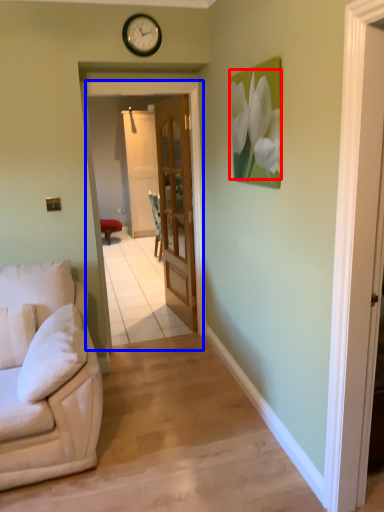
Question: Which point is closer to the camera, flower (highlighted by a red box) or screen door (highlighted by a blue box)?

Choices:
 (A) flower
 (B) screen door

Answer: (A)